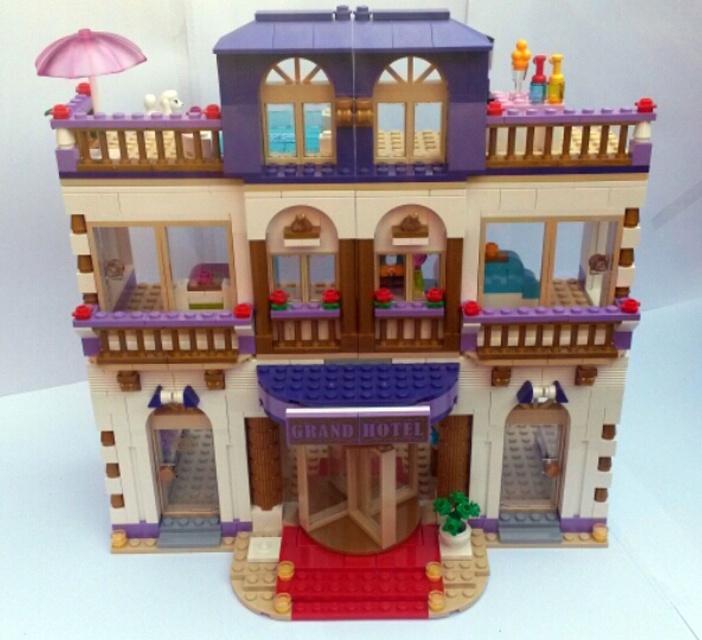
Question: Estimate the real-world distances between objects in this image. Which object is farther from the translucent yellow plastic toy at upper right?

Choices:
 (A) translucent yellow toy at upper right
 (B) pink plastic umbrella at upper left
 (C) translucent yellow plastic cup at upper center
 (D) pink translucent umbrella at upper left

Answer: (B)

Question: Which is nearer to the pink plastic umbrella at upper left?

Choices:
 (A) translucent yellow plastic toy at upper right
 (B) pink translucent umbrella at upper left

Answer: (B)

Question: Does translucent yellow plastic cup at upper center lie in front of pink plastic umbrella at upper left?

Choices:
 (A) yes
 (B) no

Answer: (B)

Question: Can you confirm if translucent yellow toy at upper right is positioned above translucent yellow plastic toy at upper right?

Choices:
 (A) no
 (B) yes

Answer: (B)

Question: In this image, where is translucent yellow plastic cup at upper center located relative to pink plastic umbrella at upper left?

Choices:
 (A) right
 (B) left

Answer: (A)

Question: Which point is closer to the camera?

Choices:
 (A) translucent yellow plastic toy at upper right
 (B) translucent yellow toy at upper right
 (C) translucent yellow plastic cup at upper center
 (D) pink plastic umbrella at upper left

Answer: (D)